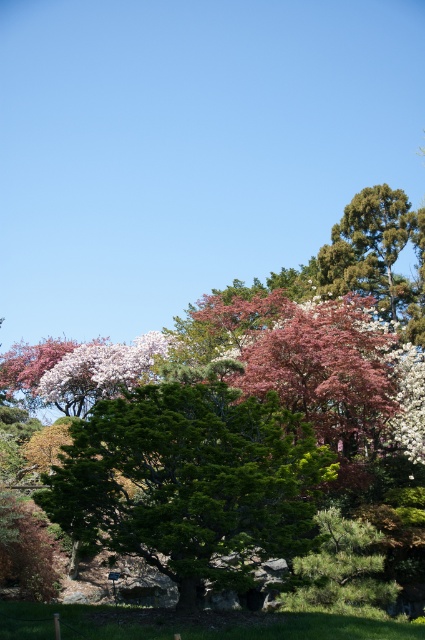
Is green leafy tree at center positioned behind green textured tree at upper right?

No.

The width and height of the screenshot is (425, 640). What do you see at coordinates (192, 483) in the screenshot?
I see `green leafy tree at center` at bounding box center [192, 483].

Locate an element on the screen. This screenshot has height=640, width=425. green leafy tree at center is located at coordinates (192, 483).

Based on the photo, is green leafy tree at center to the left of pink matte flower at center from the viewer's perspective?

No, green leafy tree at center is not to the left of pink matte flower at center.

Who is more forward, (127, 454) or (118, 388)?

Point (127, 454)

At what (x,y) coordinates should I click in order to perform the action: click on green leafy tree at center. Please return your answer as a coordinate pair (x, y). The width and height of the screenshot is (425, 640). Looking at the image, I should click on (192, 483).

The width and height of the screenshot is (425, 640). What do you see at coordinates (373, 248) in the screenshot?
I see `green textured tree at upper right` at bounding box center [373, 248].

This screenshot has width=425, height=640. I want to click on green textured tree at upper right, so click(373, 248).